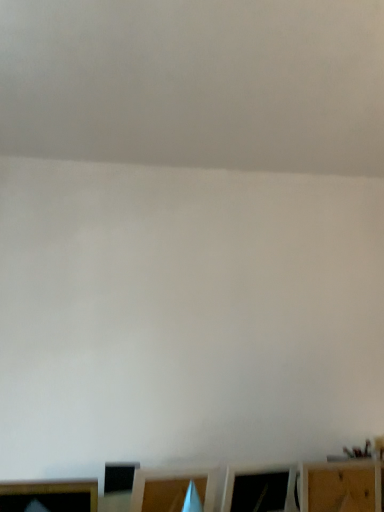
Measure the distance between wooden shelf at lower right, the 2th furniture when ordered from left to right, and camera.

A distance of 3.77 feet exists between wooden shelf at lower right, the 2th furniture when ordered from left to right, and camera.

What do you see at coordinates (341, 486) in the screenshot?
I see `wooden shelf at lower right, the 2th furniture when ordered from left to right` at bounding box center [341, 486].

At what (x,y) coordinates should I click in order to perform the action: click on wooden shelf at lower right, the 2th furniture when ordered from left to right. Please return your answer as a coordinate pair (x, y). Looking at the image, I should click on (341, 486).

Describe the element at coordinates (49, 496) in the screenshot. I see `wooden frame at lower left, marked as the second furniture in a right-to-left arrangement` at that location.

What are the coordinates of `wooden frame at lower left, the 1th furniture viewed from the left` in the screenshot? It's located at (49, 496).

What is the approximate height of wooden frame at lower left, marked as the second furniture in a right-to-left arrangement?

The height of wooden frame at lower left, marked as the second furniture in a right-to-left arrangement, is 7.39 inches.

Identify the location of wooden shelf at lower right, which appears as the 1th furniture when viewed from the right. The image size is (384, 512). (341, 486).

Is wooden frame at lower left, marked as the second furniture in a right-to-left arrangement, at the left side of wooden shelf at lower right, the 2th furniture when ordered from left to right?

Indeed, wooden frame at lower left, marked as the second furniture in a right-to-left arrangement, is positioned on the left side of wooden shelf at lower right, the 2th furniture when ordered from left to right.

Is wooden frame at lower left, marked as the second furniture in a right-to-left arrangement, in front of wooden shelf at lower right, which appears as the 1th furniture when viewed from the right?

Yes, it is.

Is point (78, 510) closer or farther from the camera than point (328, 487)?

Clearly, point (78, 510) is closer to the camera than point (328, 487).

From the image's perspective, which is above, wooden frame at lower left, the 1th furniture viewed from the left, or wooden shelf at lower right, which appears as the 1th furniture when viewed from the right?

wooden frame at lower left, the 1th furniture viewed from the left.

From a real-world perspective, is wooden frame at lower left, the 1th furniture viewed from the left, physically located above or below wooden shelf at lower right, the 2th furniture when ordered from left to right?

Clearly, from a real-world perspective, wooden frame at lower left, the 1th furniture viewed from the left, is below wooden shelf at lower right, the 2th furniture when ordered from left to right.

Can you confirm if wooden frame at lower left, the 1th furniture viewed from the left, is wider than wooden shelf at lower right, the 2th furniture when ordered from left to right?

Indeed, wooden frame at lower left, the 1th furniture viewed from the left, has a greater width compared to wooden shelf at lower right, the 2th furniture when ordered from left to right.

Considering the relative sizes of wooden frame at lower left, the 1th furniture viewed from the left, and wooden shelf at lower right, which appears as the 1th furniture when viewed from the right, in the image provided, is wooden frame at lower left, the 1th furniture viewed from the left, taller than wooden shelf at lower right, which appears as the 1th furniture when viewed from the right,?

In fact, wooden frame at lower left, the 1th furniture viewed from the left, may be shorter than wooden shelf at lower right, which appears as the 1th furniture when viewed from the right.

Considering the sizes of objects wooden frame at lower left, marked as the second furniture in a right-to-left arrangement, and wooden shelf at lower right, which appears as the 1th furniture when viewed from the right, in the image provided, who is bigger, wooden frame at lower left, marked as the second furniture in a right-to-left arrangement, or wooden shelf at lower right, which appears as the 1th furniture when viewed from the right,?

Bigger between the two is wooden frame at lower left, marked as the second furniture in a right-to-left arrangement.

Is wooden shelf at lower right, the 2th furniture when ordered from left to right, located within wooden frame at lower left, marked as the second furniture in a right-to-left arrangement?

No, wooden frame at lower left, marked as the second furniture in a right-to-left arrangement, does not contain wooden shelf at lower right, the 2th furniture when ordered from left to right.

Is wooden frame at lower left, the 1th furniture viewed from the left, directly adjacent to wooden shelf at lower right, the 2th furniture when ordered from left to right?

wooden frame at lower left, the 1th furniture viewed from the left, and wooden shelf at lower right, the 2th furniture when ordered from left to right, are not in contact.

Could you tell me if wooden frame at lower left, the 1th furniture viewed from the left, is facing wooden shelf at lower right, which appears as the 1th furniture when viewed from the right?

No.

Image resolution: width=384 pixels, height=512 pixels. What are the coordinates of `furniture located on the left of wooden shelf at lower right, which appears as the 1th furniture when viewed from the right` in the screenshot? It's located at (49, 496).

Considering the relative positions of wooden shelf at lower right, which appears as the 1th furniture when viewed from the right, and wooden frame at lower left, marked as the second furniture in a right-to-left arrangement, in the image provided, is wooden shelf at lower right, which appears as the 1th furniture when viewed from the right, to the left or to the right of wooden frame at lower left, marked as the second furniture in a right-to-left arrangement,?

In the image, wooden shelf at lower right, which appears as the 1th furniture when viewed from the right, appears on the right side of wooden frame at lower left, marked as the second furniture in a right-to-left arrangement.

Between wooden shelf at lower right, which appears as the 1th furniture when viewed from the right, and wooden frame at lower left, marked as the second furniture in a right-to-left arrangement, which one is positioned behind?

wooden shelf at lower right, which appears as the 1th furniture when viewed from the right, is behind.

Does point (336, 502) lie behind point (13, 490)?

Yes.

From the image's perspective, is wooden shelf at lower right, which appears as the 1th furniture when viewed from the right, above or below wooden frame at lower left, marked as the second furniture in a right-to-left arrangement?

From the image's perspective, wooden shelf at lower right, which appears as the 1th furniture when viewed from the right, appears below wooden frame at lower left, marked as the second furniture in a right-to-left arrangement.

From a real-world perspective, does wooden shelf at lower right, the 2th furniture when ordered from left to right, stand above wooden frame at lower left, the 1th furniture viewed from the left?

Yes, from a real-world perspective, wooden shelf at lower right, the 2th furniture when ordered from left to right, is on top of wooden frame at lower left, the 1th furniture viewed from the left.

Considering the relative sizes of wooden shelf at lower right, the 2th furniture when ordered from left to right, and wooden frame at lower left, the 1th furniture viewed from the left, in the image provided, is wooden shelf at lower right, the 2th furniture when ordered from left to right, wider than wooden frame at lower left, the 1th furniture viewed from the left,?

Incorrect, the width of wooden shelf at lower right, the 2th furniture when ordered from left to right, does not surpass that of wooden frame at lower left, the 1th furniture viewed from the left.

Considering the sizes of objects wooden shelf at lower right, which appears as the 1th furniture when viewed from the right, and wooden frame at lower left, marked as the second furniture in a right-to-left arrangement, in the image provided, who is shorter, wooden shelf at lower right, which appears as the 1th furniture when viewed from the right, or wooden frame at lower left, marked as the second furniture in a right-to-left arrangement,?

Standing shorter between the two is wooden frame at lower left, marked as the second furniture in a right-to-left arrangement.

Which of these two, wooden shelf at lower right, the 2th furniture when ordered from left to right, or wooden frame at lower left, the 1th furniture viewed from the left, is bigger?

wooden frame at lower left, the 1th furniture viewed from the left.

From the picture: Is wooden shelf at lower right, the 2th furniture when ordered from left to right, positioned beyond the bounds of wooden frame at lower left, the 1th furniture viewed from the left?

Yes, wooden shelf at lower right, the 2th furniture when ordered from left to right, is not within wooden frame at lower left, the 1th furniture viewed from the left.

Looking at this image, would you say wooden shelf at lower right, the 2th furniture when ordered from left to right, is a long distance from wooden frame at lower left, marked as the second furniture in a right-to-left arrangement?

No, there isn't a large distance between wooden shelf at lower right, the 2th furniture when ordered from left to right, and wooden frame at lower left, marked as the second furniture in a right-to-left arrangement.

Is wooden shelf at lower right, the 2th furniture when ordered from left to right, oriented towards wooden frame at lower left, marked as the second furniture in a right-to-left arrangement?

No, wooden shelf at lower right, the 2th furniture when ordered from left to right, is not aimed at wooden frame at lower left, marked as the second furniture in a right-to-left arrangement.

In order to click on furniture positioned vertically above the wooden frame at lower left, marked as the second furniture in a right-to-left arrangement (from a real-world perspective) in this screenshot , I will do `click(341, 486)`.

Where is `furniture that is below the wooden frame at lower left, marked as the second furniture in a right-to-left arrangement (from the image's perspective)`? furniture that is below the wooden frame at lower left, marked as the second furniture in a right-to-left arrangement (from the image's perspective) is located at coordinates (341, 486).

Where is `furniture on the left of wooden shelf at lower right, which appears as the 1th furniture when viewed from the right`? This screenshot has height=512, width=384. furniture on the left of wooden shelf at lower right, which appears as the 1th furniture when viewed from the right is located at coordinates (49, 496).